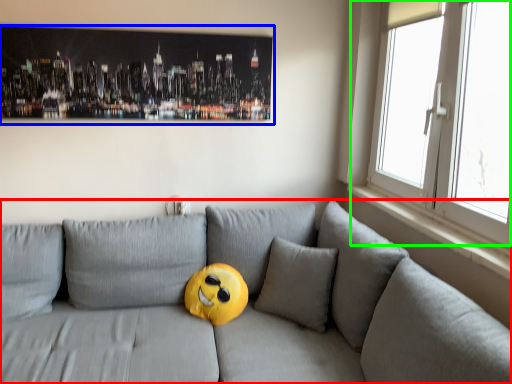
Question: Considering the real-world distances, which object is closest to studio couch (highlighted by a red box)? picture frame (highlighted by a blue box) or window (highlighted by a green box).

Choices:
 (A) picture frame
 (B) window

Answer: (B)